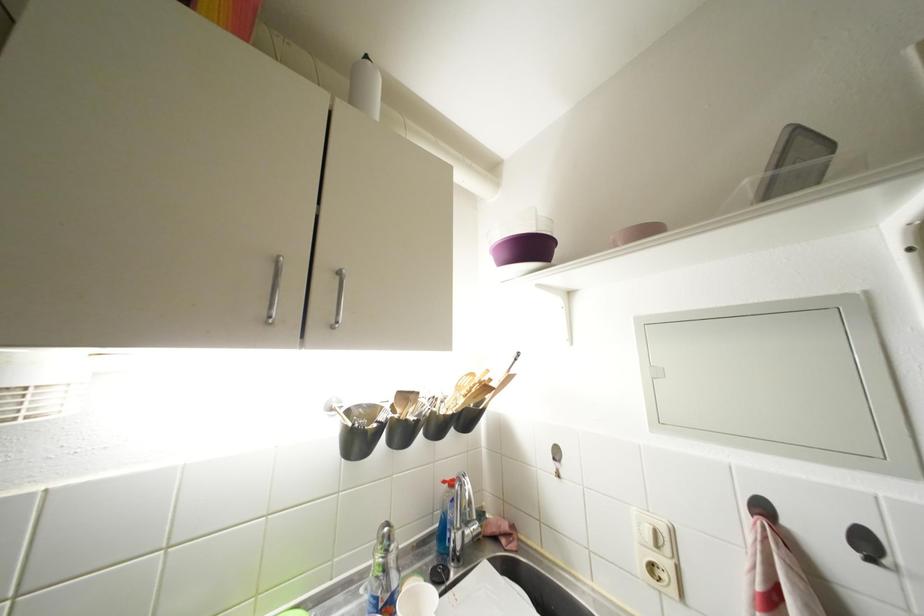
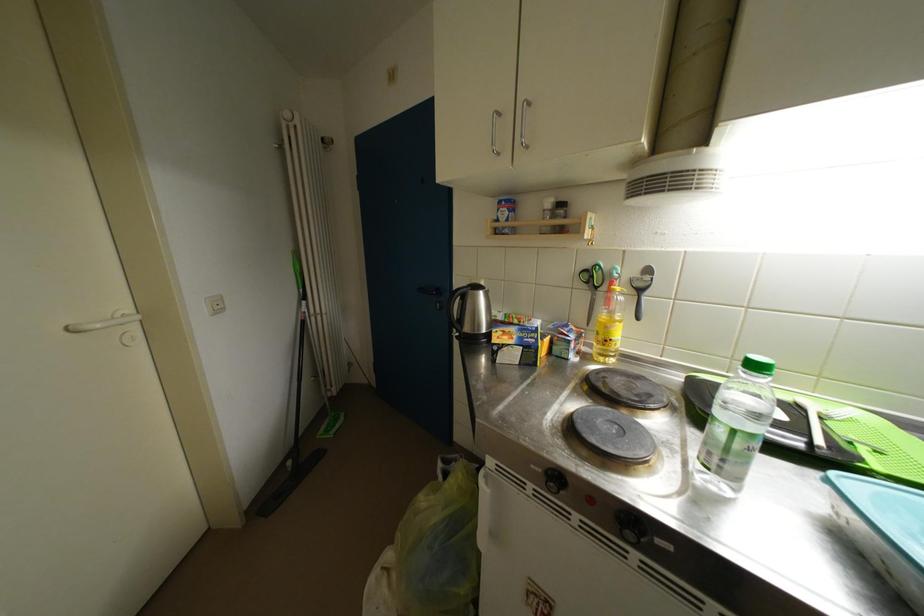
The images are taken continuously from a first-person perspective. In which direction is your viewpoint rotating?

The camera's rotation is toward left-down.